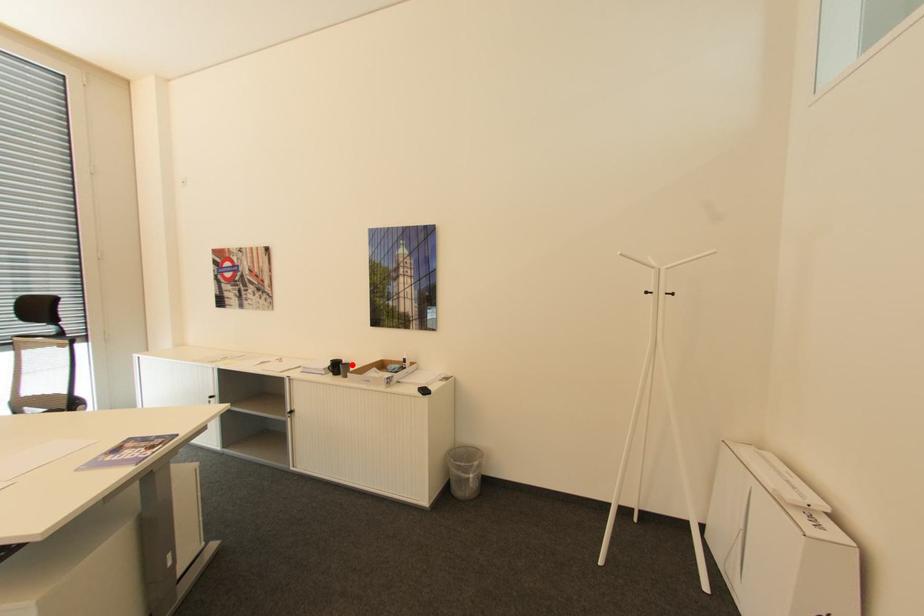
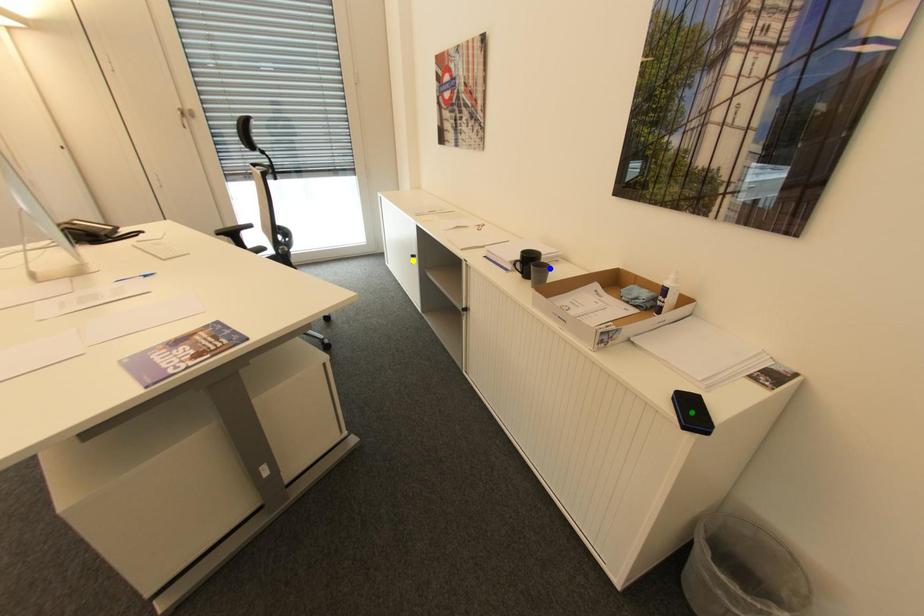
Question: I am providing you with two images of the same scene from different viewpoints. A red point is marked on the first image. You are given multiple points on the second image. Which point in image 2 represents the same 3d spot as the red point in image 1?

Choices:
 (A) yellow point
 (B) green point
 (C) blue point

Answer: (C)